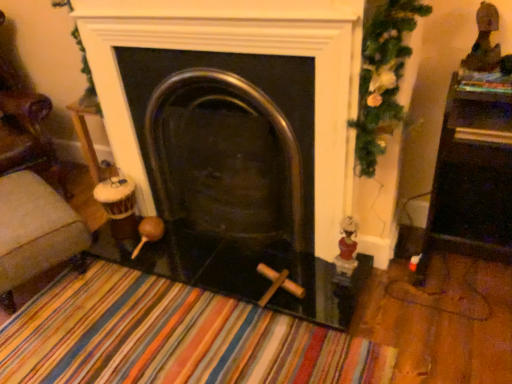
Question: Can you confirm if polished metal fireplace at center is shorter than shiny dark brown statue at upper right, which is counted as the 1th toy, starting from the top?

Choices:
 (A) yes
 (B) no

Answer: (B)

Question: Is polished metal fireplace at center positioned with its back to shiny dark brown statue at upper right, which is the 2th toy from left to right?

Choices:
 (A) no
 (B) yes

Answer: (A)

Question: Would you consider polished metal fireplace at center to be distant from shiny dark brown statue at upper right, arranged as the second toy when ordered from the bottom?

Choices:
 (A) yes
 (B) no

Answer: (B)

Question: Does polished metal fireplace at center have a lesser width compared to shiny dark brown statue at upper right, which is the 2th toy from left to right?

Choices:
 (A) no
 (B) yes

Answer: (A)

Question: Are polished metal fireplace at center and shiny dark brown statue at upper right, which is the 2th toy from left to right, making contact?

Choices:
 (A) yes
 (B) no

Answer: (B)

Question: Considering their positions, is velvet beige ottoman at left located in front of or behind white porcelain figurine at right, the second toy from the right?

Choices:
 (A) behind
 (B) front

Answer: (A)

Question: In terms of width, does velvet beige ottoman at left look wider or thinner when compared to white porcelain figurine at right, acting as the first toy starting from the bottom?

Choices:
 (A) thin
 (B) wide

Answer: (B)

Question: Based on their sizes in the image, would you say velvet beige ottoman at left is bigger or smaller than white porcelain figurine at right, the first toy in the left-to-right sequence?

Choices:
 (A) small
 (B) big

Answer: (B)

Question: Is velvet beige ottoman at left situated inside white porcelain figurine at right, which appears as the second toy when viewed from the top, or outside?

Choices:
 (A) outside
 (B) inside

Answer: (A)

Question: From a real-world perspective, is white porcelain figurine at right, the second toy from the right, above or below polished metal fireplace at center?

Choices:
 (A) below
 (B) above

Answer: (A)

Question: Considering the positions of white porcelain figurine at right, the first toy in the left-to-right sequence, and polished metal fireplace at center in the image, is white porcelain figurine at right, the first toy in the left-to-right sequence, wider or thinner than polished metal fireplace at center?

Choices:
 (A) thin
 (B) wide

Answer: (A)

Question: Is point (335, 269) closer or farther from the camera than point (231, 89)?

Choices:
 (A) closer
 (B) farther

Answer: (B)

Question: In the image, is white porcelain figurine at right, which appears as the second toy when viewed from the top, on the left side or the right side of polished metal fireplace at center?

Choices:
 (A) right
 (B) left

Answer: (A)

Question: In terms of height, does velvet beige ottoman at left look taller or shorter compared to polished metal fireplace at center?

Choices:
 (A) tall
 (B) short

Answer: (B)

Question: Is velvet beige ottoman at left bigger or smaller than polished metal fireplace at center?

Choices:
 (A) big
 (B) small

Answer: (B)